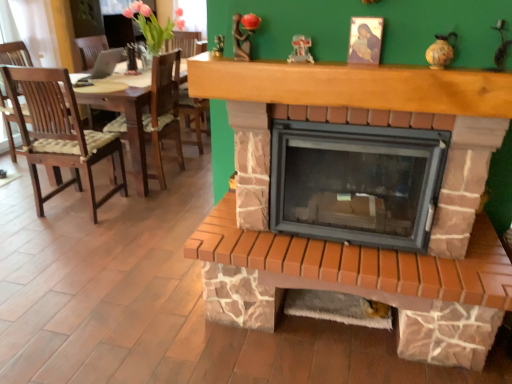
Where is `brick fireplace at center`? brick fireplace at center is located at coordinates (356, 182).

What do you see at coordinates (356, 182) in the screenshot? I see `brick fireplace at center` at bounding box center [356, 182].

Where is `brown wood mantle at upper center`? brown wood mantle at upper center is located at coordinates [353, 86].

What do you see at coordinates (353, 86) in the screenshot? The image size is (512, 384). I see `brown wood mantle at upper center` at bounding box center [353, 86].

Image resolution: width=512 pixels, height=384 pixels. Identify the location of brick fireplace at center. (356, 182).

Considering the relative positions of brown wood mantle at upper center and brick fireplace at center in the image provided, is brown wood mantle at upper center to the right of brick fireplace at center from the viewer's perspective?

In fact, brown wood mantle at upper center is to the left of brick fireplace at center.

Which object is closer to the camera taking this photo, brown wood mantle at upper center or brick fireplace at center?

brown wood mantle at upper center is closer to the camera.

Which point is more forward, (200,85) or (317,188)?

The point (200,85) is closer to the camera.

From the image's perspective, which object appears higher, brown wood mantle at upper center or brick fireplace at center?

brown wood mantle at upper center appears higher in the image.

From a real-world perspective, who is located lower, brown wood mantle at upper center or brick fireplace at center?

brick fireplace at center.

Which of these two, brown wood mantle at upper center or brick fireplace at center, is wider?

brown wood mantle at upper center.

Between brown wood mantle at upper center and brick fireplace at center, which one has more height?

With more height is brick fireplace at center.

Who is bigger, brown wood mantle at upper center or brick fireplace at center?

brick fireplace at center is bigger.

Could brick fireplace at center be considered to be inside brown wood mantle at upper center?

No, brown wood mantle at upper center does not contain brick fireplace at center.

Would you say brown wood mantle at upper center is a long distance from brick fireplace at center?

That's not correct — brown wood mantle at upper center is a little close to brick fireplace at center.

Is brick fireplace at center at the back of brown wood mantle at upper center?

brown wood mantle at upper center is not turned away from brick fireplace at center.

At what (x,y) coordinates should I click in order to perform the action: click on wood burning stove behind the brown wood mantle at upper center. Please return your answer as a coordinate pair (x, y). Looking at the image, I should click on (356, 182).

Considering the relative positions of brick fireplace at center and brown wood mantle at upper center in the image provided, is brick fireplace at center to the left of brown wood mantle at upper center from the viewer's perspective?

No.

Is brick fireplace at center in front of brown wood mantle at upper center?

No, brick fireplace at center is behind brown wood mantle at upper center.

Between point (272, 176) and point (302, 83), which one is positioned behind?

Positioned behind is point (272, 176).

From the image's perspective, who appears lower, brick fireplace at center or brown wood mantle at upper center?

brick fireplace at center is shown below in the image.

From a real-world perspective, is brick fireplace at center below brown wood mantle at upper center?

Yes, from a real-world perspective, brick fireplace at center is below brown wood mantle at upper center.

Considering the relative sizes of brick fireplace at center and brown wood mantle at upper center in the image provided, is brick fireplace at center thinner than brown wood mantle at upper center?

Correct, the width of brick fireplace at center is less than that of brown wood mantle at upper center.

Between brick fireplace at center and brown wood mantle at upper center, which one has more height?

brick fireplace at center.

Between brick fireplace at center and brown wood mantle at upper center, which one has smaller size?

brown wood mantle at upper center is smaller.

Do you think brick fireplace at center is within brown wood mantle at upper center, or outside of it?

brick fireplace at center is outside brown wood mantle at upper center.

Is the surface of brick fireplace at center in direct contact with brown wood mantle at upper center?

They are not placed beside each other.

Is brick fireplace at center oriented away from brown wood mantle at upper center?

brick fireplace at center is not turned away from brown wood mantle at upper center.

How many degrees apart are the facing directions of brick fireplace at center and brown wood mantle at upper center?

The angle between the facing direction of brick fireplace at center and the facing direction of brown wood mantle at upper center is 0.000222 degrees.

How much distance is there between brick fireplace at center and brown wood mantle at upper center?

They are 16.95 inches apart.

The image size is (512, 384). What are the coordinates of `wood burning stove that appears behind the brown wood mantle at upper center` in the screenshot? It's located at point(356,182).

Locate an element on the screen. This screenshot has width=512, height=384. mantle above the brick fireplace at center (from a real-world perspective) is located at coordinates (353, 86).

What are the coordinates of `mantle that is above the brick fireplace at center (from the image's perspective)` in the screenshot? It's located at (353, 86).